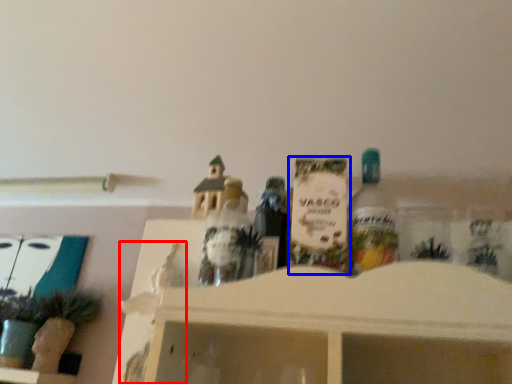
Question: Which point is further to the camera, toy (highlighted by a red box) or toy (highlighted by a blue box)?

Choices:
 (A) toy
 (B) toy

Answer: (A)